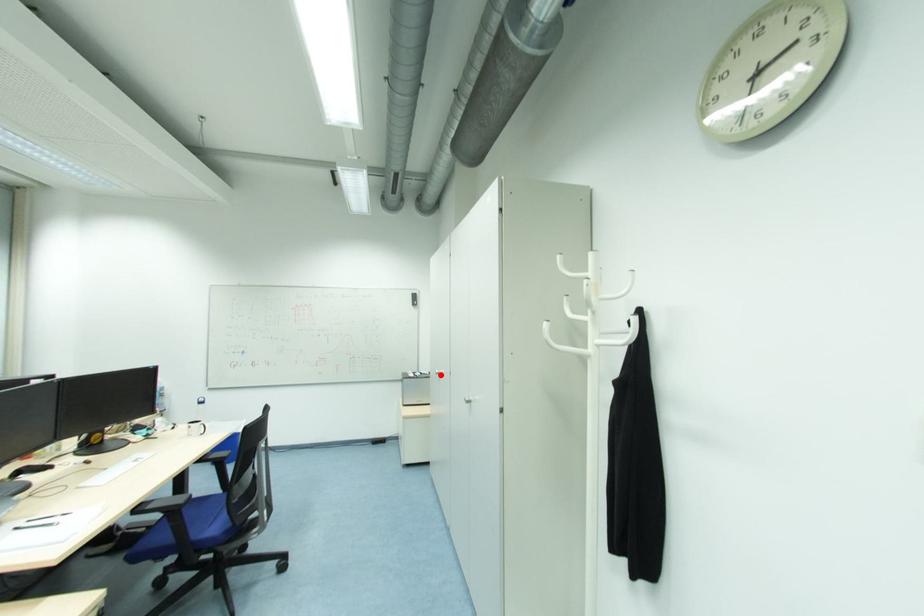
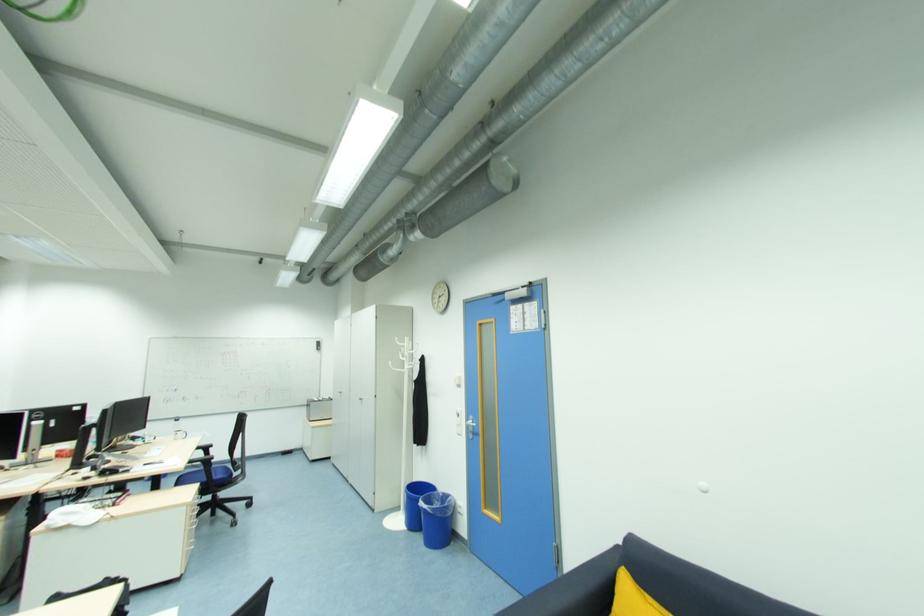
In the second image, find the point that corresponds to the highlighted location in the first image.

(344, 394)